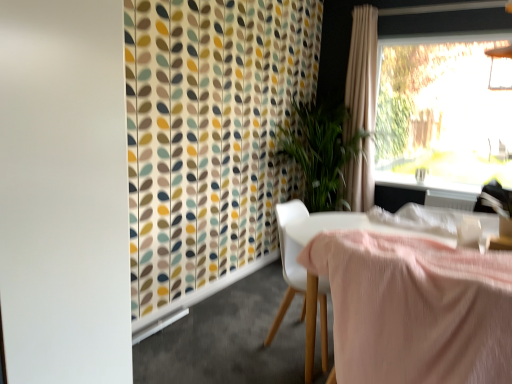
Question: Considering the relative sizes of white plastic chair at center and pink fabric-covered table at center in the image provided, is white plastic chair at center bigger than pink fabric-covered table at center?

Choices:
 (A) yes
 (B) no

Answer: (B)

Question: From the image's perspective, is white plastic chair at center under pink fabric-covered table at center?

Choices:
 (A) yes
 (B) no

Answer: (B)

Question: Can you confirm if white plastic chair at center is wider than pink fabric-covered table at center?

Choices:
 (A) no
 (B) yes

Answer: (A)

Question: From a real-world perspective, is white plastic chair at center on pink fabric-covered table at center?

Choices:
 (A) yes
 (B) no

Answer: (A)

Question: Can you confirm if white plastic chair at center is thinner than pink fabric-covered table at center?

Choices:
 (A) no
 (B) yes

Answer: (B)

Question: Based on their positions, is white plastic chair at center located to the left or right of white glossy window sill at upper right?

Choices:
 (A) right
 (B) left

Answer: (B)

Question: Is white plastic chair at center inside or outside of white glossy window sill at upper right?

Choices:
 (A) inside
 (B) outside

Answer: (B)

Question: Looking at their shapes, would you say white plastic chair at center is wider or thinner than white glossy window sill at upper right?

Choices:
 (A) thin
 (B) wide

Answer: (B)

Question: Is white plastic chair at center in front of or behind white glossy window sill at upper right in the image?

Choices:
 (A) front
 (B) behind

Answer: (A)

Question: Is transparent glass window at upper right situated inside white matte screen door at left or outside?

Choices:
 (A) outside
 (B) inside

Answer: (A)

Question: From their relative heights in the image, would you say transparent glass window at upper right is taller or shorter than white matte screen door at left?

Choices:
 (A) tall
 (B) short

Answer: (B)

Question: From a real-world perspective, relative to white matte screen door at left, is transparent glass window at upper right vertically above or below?

Choices:
 (A) above
 (B) below

Answer: (A)

Question: From the image's perspective, relative to white matte screen door at left, is transparent glass window at upper right above or below?

Choices:
 (A) below
 (B) above

Answer: (B)

Question: From the image's perspective, is white matte screen door at left positioned above or below pink fabric-covered table at center?

Choices:
 (A) above
 (B) below

Answer: (A)

Question: Is white matte screen door at left to the left or to the right of pink fabric-covered table at center in the image?

Choices:
 (A) right
 (B) left

Answer: (B)